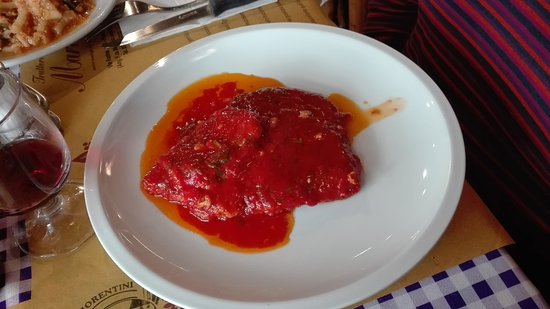
Identify the location of silverware. The width and height of the screenshot is (550, 309). (172, 20), (133, 5).